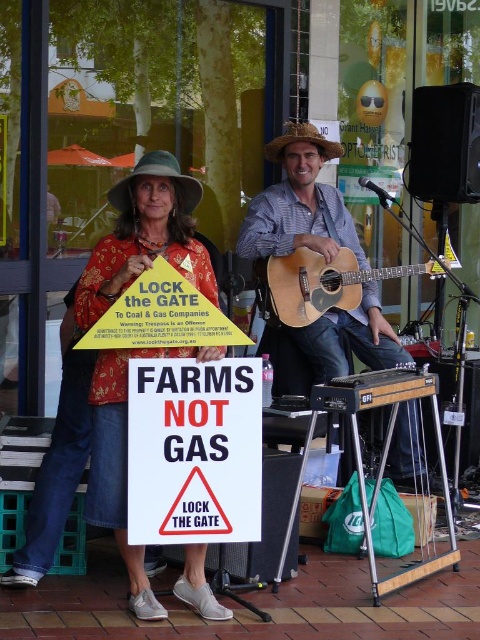
You are a photographer positioned at the origin point of the image coordinate system. You want to capture a closeup shot of the wooden acoustic guitar at center. What are the exact coordinates you should aim your camera at?

The exact coordinates to aim the camera at are point [299,212], as that is the 2D location of the wooden acoustic guitar at center.

You are organizing a small outdoor concert and need to place two acoustic guitars on a 1.2 meter wide stage. The wooden acoustic guitar at center and the natural wood acoustic guitar at center are both available. Which guitar should you choose to ensure it fits comfortably on the stage without overcrowding?

The wooden acoustic guitar at center has a smaller width compared to the natural wood acoustic guitar at center. Since the wooden acoustic guitar at center is narrower, it will fit more comfortably on the 1.2 meter wide stage without overcrowding.